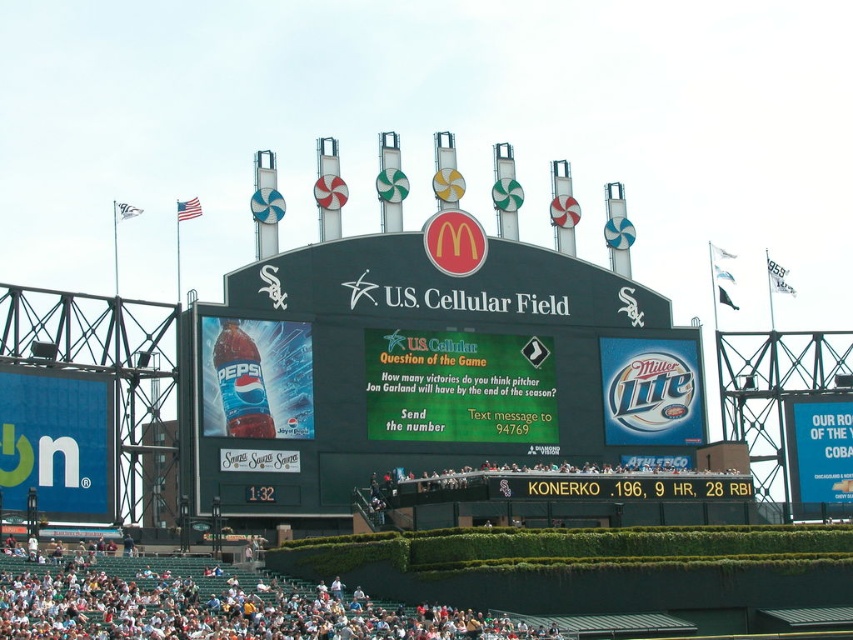
You are standing at the center of the field in U.S. Cellular Field. You see two points marked on the scoreboard. The first point is at coordinates point (410,276) and the second is at point (39,576). Which point is closer to you?

Point (39,576) is closer to you because it is nearer to the viewer compared to point (410,276), which is further away.